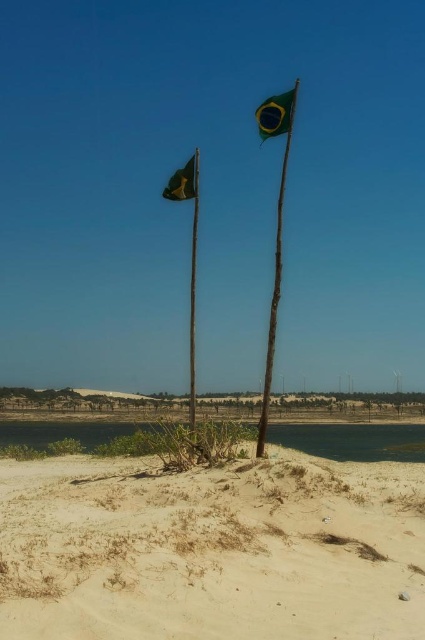
Question: Is the position of wooden flag pole at center less distant than that of green fabric flag at upper center?

Choices:
 (A) yes
 (B) no

Answer: (A)

Question: Observing the image, what is the correct spatial positioning of wooden flag pole at center in reference to green fabric flag at upper center?

Choices:
 (A) below
 (B) above

Answer: (A)

Question: Considering the real-world distances, which object is farthest from the green fabric flag pole at center?

Choices:
 (A) clear water at lower center
 (B) green fabric flag at center
 (C) wooden flag pole at center
 (D) green fabric flag at upper center

Answer: (D)

Question: Which is nearer to the green fabric flag pole at center?

Choices:
 (A) green fabric flag at upper center
 (B) sandy beige sand at lower center

Answer: (A)

Question: Does clear water at lower center have a greater width compared to wooden flag pole at center?

Choices:
 (A) no
 (B) yes

Answer: (B)

Question: Among these objects, which one is farthest from the camera?

Choices:
 (A) green fabric flag pole at center
 (B) green fabric flag at center

Answer: (B)